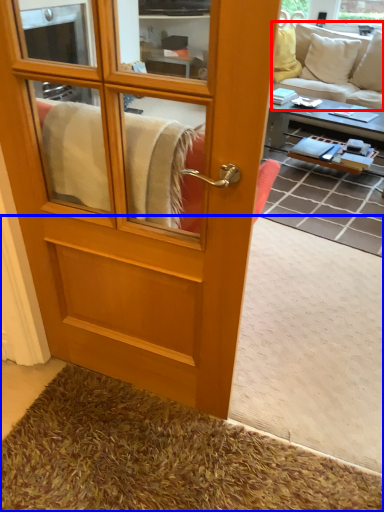
Question: Which object is further to the camera taking this photo, studio couch (highlighted by a red box) or carpets (highlighted by a blue box)?

Choices:
 (A) studio couch
 (B) carpets

Answer: (A)